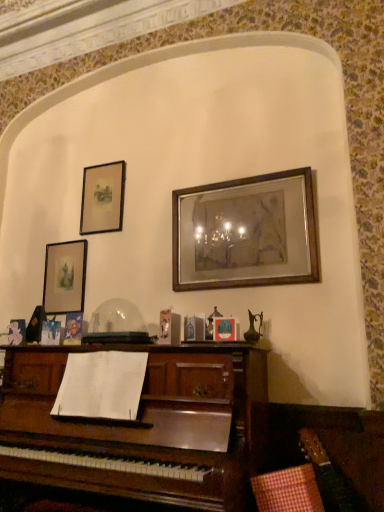
I want to click on matte black picture frame at upper left, which ranks as the second picture frame in right-to-left order, so tap(102, 198).

Find the location of a particular element. The width and height of the screenshot is (384, 512). wooden picture frame at center, which ranks as the first picture frame in right-to-left order is located at coordinates (245, 233).

This screenshot has width=384, height=512. I want to click on matte gold picture frame at upper left, positioned as the first picture frame in left-to-right order, so click(x=65, y=277).

Describe the element at coordinates (65, 277) in the screenshot. This screenshot has height=512, width=384. I see `matte gold picture frame at upper left, positioned as the first picture frame in left-to-right order` at that location.

Image resolution: width=384 pixels, height=512 pixels. In order to click on matte black picture frame at upper left, the 2th picture frame when ordered from left to right in this screenshot , I will do `click(102, 198)`.

Is wooden picture frame at center, placed as the 3th picture frame when sorted from left to right, in front of or behind matte black picture frame at upper left, the 2th picture frame when ordered from left to right, in the image?

In the image, wooden picture frame at center, placed as the 3th picture frame when sorted from left to right, appears in front of matte black picture frame at upper left, the 2th picture frame when ordered from left to right.

From the picture: From a real-world perspective, is wooden picture frame at center, which ranks as the first picture frame in right-to-left order, physically below matte black picture frame at upper left, the 2th picture frame when ordered from left to right?

Yes.

Starting from the matte black picture frame at upper left, which ranks as the second picture frame in right-to-left order, which picture frame is the 2nd one in front? Please provide its 2D coordinates.

[(245, 233)]

Does matte black picture frame at upper left, the 2th picture frame when ordered from left to right, lie behind matte gold picture frame at upper left, positioned as the 3th picture frame in right-to-left order?

Answer: Yes, it is.

Which object is wider, matte black picture frame at upper left, which ranks as the second picture frame in right-to-left order, or matte gold picture frame at upper left, positioned as the first picture frame in left-to-right order?

With larger width is matte gold picture frame at upper left, positioned as the first picture frame in left-to-right order.

From a real-world perspective, which object rests below the other?

In real-world perspective, matte gold picture frame at upper left, positioned as the first picture frame in left-to-right order, is lower.

Is matte gold picture frame at upper left, positioned as the 3th picture frame in right-to-left order, located within matte black picture frame at upper left, which ranks as the second picture frame in right-to-left order?

No, matte gold picture frame at upper left, positioned as the 3th picture frame in right-to-left order, is not surrounded by matte black picture frame at upper left, which ranks as the second picture frame in right-to-left order.

Considering the sizes of objects matte gold picture frame at upper left, positioned as the first picture frame in left-to-right order, and wooden picture frame at center, which ranks as the first picture frame in right-to-left order, in the image provided, who is bigger, matte gold picture frame at upper left, positioned as the first picture frame in left-to-right order, or wooden picture frame at center, which ranks as the first picture frame in right-to-left order,?

wooden picture frame at center, which ranks as the first picture frame in right-to-left order.

Would you say matte gold picture frame at upper left, positioned as the 3th picture frame in right-to-left order, is to the left or to the right of wooden picture frame at center, placed as the 3th picture frame when sorted from left to right, in the picture?

matte gold picture frame at upper left, positioned as the 3th picture frame in right-to-left order, is positioned on wooden picture frame at center, placed as the 3th picture frame when sorted from left to right,'s left side.

From a real-world perspective, who is located lower, matte gold picture frame at upper left, positioned as the 3th picture frame in right-to-left order, or wooden picture frame at center, placed as the 3th picture frame when sorted from left to right?

matte gold picture frame at upper left, positioned as the 3th picture frame in right-to-left order, from a real-world perspective.

Is matte gold picture frame at upper left, positioned as the first picture frame in left-to-right order, situated inside wooden picture frame at center, which ranks as the first picture frame in right-to-left order, or outside?

matte gold picture frame at upper left, positioned as the first picture frame in left-to-right order, is not enclosed by wooden picture frame at center, which ranks as the first picture frame in right-to-left order.

Is matte black picture frame at upper left, which ranks as the second picture frame in right-to-left order, shorter than wooden picture frame at center, which ranks as the first picture frame in right-to-left order?

Yes, matte black picture frame at upper left, which ranks as the second picture frame in right-to-left order, is shorter than wooden picture frame at center, which ranks as the first picture frame in right-to-left order.

Which is closer, (x=116, y=170) or (x=211, y=221)?

Point (x=211, y=221)

Between matte black picture frame at upper left, the 2th picture frame when ordered from left to right, and wooden picture frame at center, which ranks as the first picture frame in right-to-left order, which one is positioned behind?

matte black picture frame at upper left, the 2th picture frame when ordered from left to right, is more distant.

How far apart are matte black picture frame at upper left, which ranks as the second picture frame in right-to-left order, and wooden picture frame at center, which ranks as the first picture frame in right-to-left order?

The distance of matte black picture frame at upper left, which ranks as the second picture frame in right-to-left order, from wooden picture frame at center, which ranks as the first picture frame in right-to-left order, is 76.02 centimeters.

Is matte gold picture frame at upper left, positioned as the first picture frame in left-to-right order, aimed at matte black picture frame at upper left, the 2th picture frame when ordered from left to right?

No, matte gold picture frame at upper left, positioned as the first picture frame in left-to-right order, does not turn towards matte black picture frame at upper left, the 2th picture frame when ordered from left to right.

In the scene shown: Is matte gold picture frame at upper left, positioned as the 3th picture frame in right-to-left order, inside the boundaries of matte black picture frame at upper left, the 2th picture frame when ordered from left to right, or outside?

matte gold picture frame at upper left, positioned as the 3th picture frame in right-to-left order, is spatially situated outside matte black picture frame at upper left, the 2th picture frame when ordered from left to right.

Which object is more forward, matte gold picture frame at upper left, positioned as the first picture frame in left-to-right order, or matte black picture frame at upper left, the 2th picture frame when ordered from left to right?

matte gold picture frame at upper left, positioned as the first picture frame in left-to-right order, is in front.

From a real-world perspective, is wooden picture frame at center, which ranks as the first picture frame in right-to-left order, on matte gold picture frame at upper left, positioned as the first picture frame in left-to-right order?

Yes, from a real-world perspective, wooden picture frame at center, which ranks as the first picture frame in right-to-left order, is on top of matte gold picture frame at upper left, positioned as the first picture frame in left-to-right order.

In terms of height, does wooden picture frame at center, placed as the 3th picture frame when sorted from left to right, look taller or shorter compared to matte gold picture frame at upper left, positioned as the first picture frame in left-to-right order?

Clearly, wooden picture frame at center, placed as the 3th picture frame when sorted from left to right, is taller compared to matte gold picture frame at upper left, positioned as the first picture frame in left-to-right order.

Which object is wider, wooden picture frame at center, which ranks as the first picture frame in right-to-left order, or matte gold picture frame at upper left, positioned as the 3th picture frame in right-to-left order?

With larger width is wooden picture frame at center, which ranks as the first picture frame in right-to-left order.

Can we say wooden picture frame at center, which ranks as the first picture frame in right-to-left order, lies outside matte gold picture frame at upper left, positioned as the 3th picture frame in right-to-left order?

Absolutely, wooden picture frame at center, which ranks as the first picture frame in right-to-left order, is external to matte gold picture frame at upper left, positioned as the 3th picture frame in right-to-left order.

Find the location of a particular element. This screenshot has width=384, height=512. picture frame on the right of matte black picture frame at upper left, which ranks as the second picture frame in right-to-left order is located at coordinates (245, 233).

Where is `the 2nd picture frame below the matte black picture frame at upper left, the 2th picture frame when ordered from left to right (from the image's perspective)`? Image resolution: width=384 pixels, height=512 pixels. the 2nd picture frame below the matte black picture frame at upper left, the 2th picture frame when ordered from left to right (from the image's perspective) is located at coordinates (65, 277).

Estimate the real-world distances between objects in this image. Which object is closer to matte black picture frame at upper left, which ranks as the second picture frame in right-to-left order, wooden picture frame at center, placed as the 3th picture frame when sorted from left to right, or matte gold picture frame at upper left, positioned as the 3th picture frame in right-to-left order?

Based on the image, matte gold picture frame at upper left, positioned as the 3th picture frame in right-to-left order, appears to be nearer to matte black picture frame at upper left, which ranks as the second picture frame in right-to-left order.

When comparing their distances from matte black picture frame at upper left, which ranks as the second picture frame in right-to-left order, does matte gold picture frame at upper left, positioned as the 3th picture frame in right-to-left order, or wooden picture frame at center, placed as the 3th picture frame when sorted from left to right, seem closer?

matte gold picture frame at upper left, positioned as the 3th picture frame in right-to-left order.

Which object lies nearer to the anchor point matte gold picture frame at upper left, positioned as the first picture frame in left-to-right order, matte black picture frame at upper left, the 2th picture frame when ordered from left to right, or wooden picture frame at center, placed as the 3th picture frame when sorted from left to right?

matte black picture frame at upper left, the 2th picture frame when ordered from left to right, is positioned closer to the anchor matte gold picture frame at upper left, positioned as the first picture frame in left-to-right order.

From the image, which object appears to be farther from wooden picture frame at center, placed as the 3th picture frame when sorted from left to right, matte gold picture frame at upper left, positioned as the first picture frame in left-to-right order, or matte black picture frame at upper left, which ranks as the second picture frame in right-to-left order?

matte gold picture frame at upper left, positioned as the first picture frame in left-to-right order, is further to wooden picture frame at center, placed as the 3th picture frame when sorted from left to right.

When comparing their distances from wooden picture frame at center, which ranks as the first picture frame in right-to-left order, does matte black picture frame at upper left, the 2th picture frame when ordered from left to right, or matte gold picture frame at upper left, positioned as the first picture frame in left-to-right order, seem closer?

Based on the image, matte black picture frame at upper left, the 2th picture frame when ordered from left to right, appears to be nearer to wooden picture frame at center, which ranks as the first picture frame in right-to-left order.

From the image, which object appears to be farther from matte gold picture frame at upper left, positioned as the first picture frame in left-to-right order, wooden picture frame at center, which ranks as the first picture frame in right-to-left order, or matte black picture frame at upper left, which ranks as the second picture frame in right-to-left order?

The object further to matte gold picture frame at upper left, positioned as the first picture frame in left-to-right order, is wooden picture frame at center, which ranks as the first picture frame in right-to-left order.

Where is `picture frame between matte gold picture frame at upper left, positioned as the first picture frame in left-to-right order, and wooden picture frame at center, which ranks as the first picture frame in right-to-left order`? picture frame between matte gold picture frame at upper left, positioned as the first picture frame in left-to-right order, and wooden picture frame at center, which ranks as the first picture frame in right-to-left order is located at coordinates (102, 198).